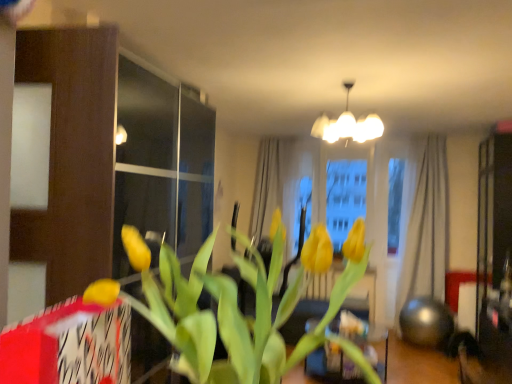
Question: Is white glossy chandelier at upper center wider than beige fabric curtain at right?

Choices:
 (A) yes
 (B) no

Answer: (A)

Question: Could beige fabric curtain at right be considered to be inside white glossy chandelier at upper center?

Choices:
 (A) no
 (B) yes

Answer: (A)

Question: Considering the relative sizes of white glossy chandelier at upper center and beige fabric curtain at right in the image provided, is white glossy chandelier at upper center thinner than beige fabric curtain at right?

Choices:
 (A) yes
 (B) no

Answer: (B)

Question: Is white glossy chandelier at upper center positioned in front of beige fabric curtain at right?

Choices:
 (A) no
 (B) yes

Answer: (B)

Question: Is white glossy chandelier at upper center beside beige fabric curtain at right?

Choices:
 (A) yes
 (B) no

Answer: (B)

Question: Is white glossy chandelier at upper center smaller than beige fabric curtain at right?

Choices:
 (A) yes
 (B) no

Answer: (A)

Question: Considering the relative sizes of beige fabric curtain at right and white glossy chandelier at upper center in the image provided, is beige fabric curtain at right thinner than white glossy chandelier at upper center?

Choices:
 (A) no
 (B) yes

Answer: (B)

Question: From a real-world perspective, is beige fabric curtain at right over white glossy chandelier at upper center?

Choices:
 (A) yes
 (B) no

Answer: (B)

Question: Is beige fabric curtain at right further to the viewer compared to white glossy chandelier at upper center?

Choices:
 (A) yes
 (B) no

Answer: (A)

Question: Is beige fabric curtain at right bigger than white glossy chandelier at upper center?

Choices:
 (A) no
 (B) yes

Answer: (B)

Question: Is white glossy chandelier at upper center inside beige fabric curtain at right?

Choices:
 (A) no
 (B) yes

Answer: (A)

Question: Are beige fabric curtain at right and white glossy chandelier at upper center far apart?

Choices:
 (A) no
 (B) yes

Answer: (B)

Question: Can you see yellow matte tulip at center touching white glossy chandelier at upper center?

Choices:
 (A) no
 (B) yes

Answer: (A)